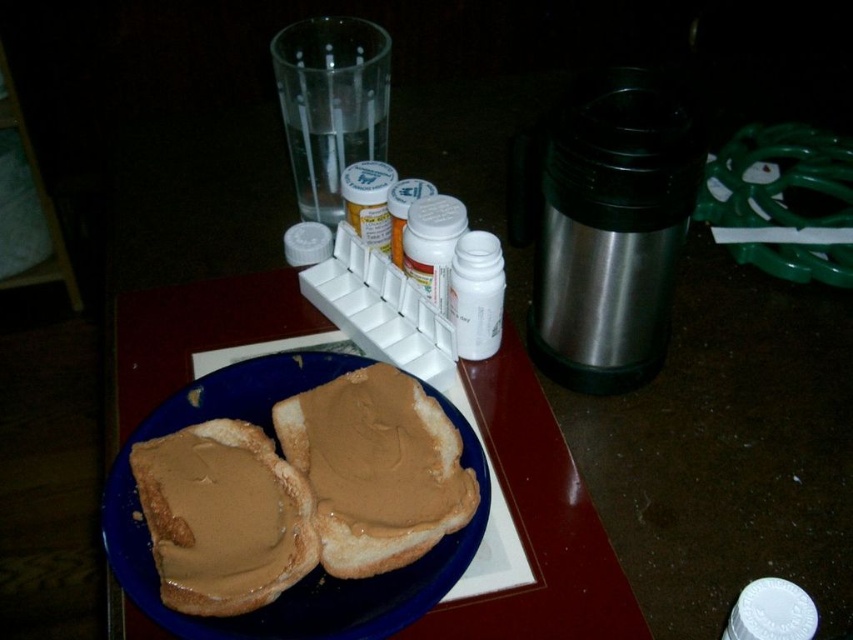
Question: Does brown matte peanut butter sandwich at center appear over brown matte peanut butter spread at center?

Choices:
 (A) no
 (B) yes

Answer: (B)

Question: Which of the following is the farthest from the observer?

Choices:
 (A) blue matte plate at center
 (B) brown matte peanut butter spread at center

Answer: (B)

Question: Does blue matte plate at center lie in front of brown matte peanut butter sandwich at center?

Choices:
 (A) yes
 (B) no

Answer: (A)

Question: Is brown matte peanut butter sandwich at center above brown matte peanut butter spread at center?

Choices:
 (A) no
 (B) yes

Answer: (B)

Question: Which object is positioned closest to the blue matte plate at center?

Choices:
 (A) brown matte peanut butter spread at center
 (B) brown matte peanut butter sandwich at center

Answer: (A)

Question: Which point appears farthest from the camera in this image?

Choices:
 (A) (262, 611)
 (B) (434, 404)

Answer: (B)